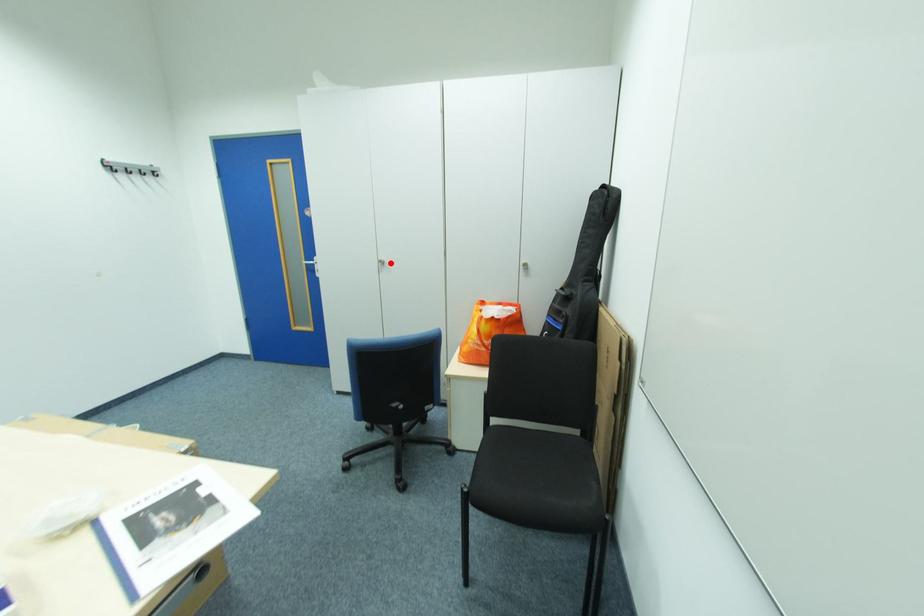
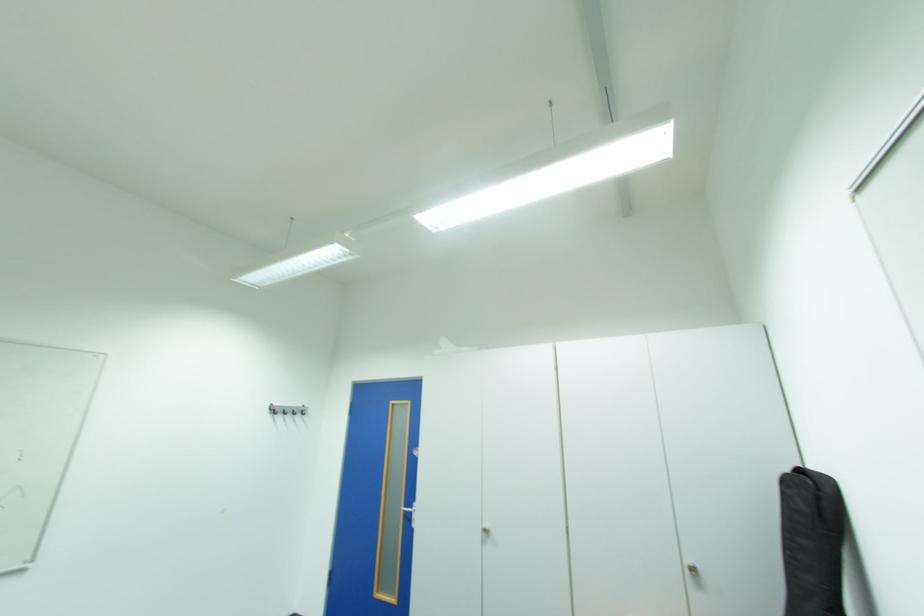
Locate, in the second image, the point that corresponds to the highlighted location in the first image.

(495, 532)